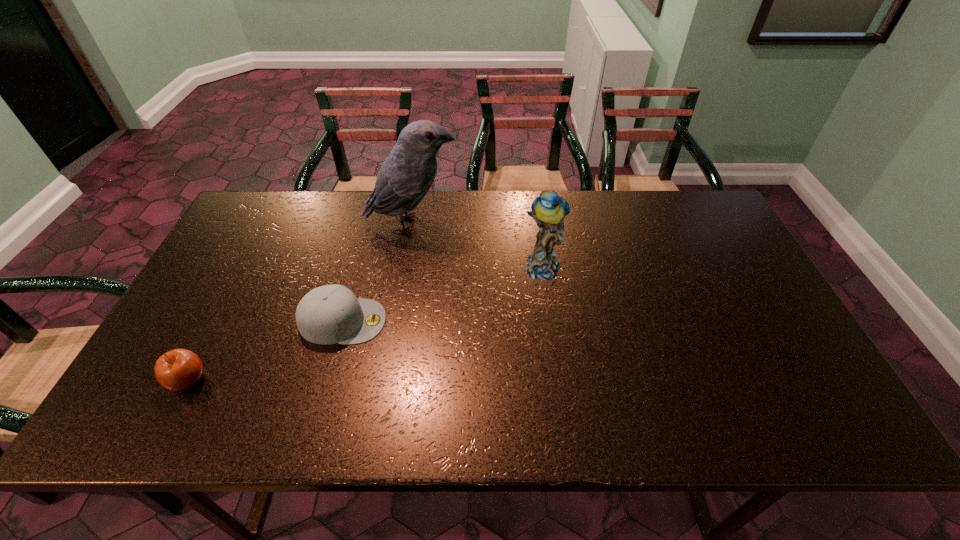
I want to click on the farthest object, so click(405, 177).

Where is `the farther parrot`? Image resolution: width=960 pixels, height=540 pixels. the farther parrot is located at coordinates (405, 177).

Locate an element on the screen. This screenshot has width=960, height=540. the nearer parrot is located at coordinates (548, 210).

Where is `the rightmost object`? The width and height of the screenshot is (960, 540). the rightmost object is located at coordinates (548, 210).

Where is `the leftmost object`? This screenshot has height=540, width=960. the leftmost object is located at coordinates (179, 369).

What are the coordinates of `the nearest object` in the screenshot? It's located at (179, 369).

Image resolution: width=960 pixels, height=540 pixels. Identify the location of the shortest object. (330, 314).

Where is `cap`? Image resolution: width=960 pixels, height=540 pixels. cap is located at coordinates (330, 314).

Find the location of `blank space located on the front-facing side of the farthest object`. blank space located on the front-facing side of the farthest object is located at coordinates (499, 225).

The image size is (960, 540). Identify the location of vacant region located 0.230m on the face of the nearer parrot. (555, 356).